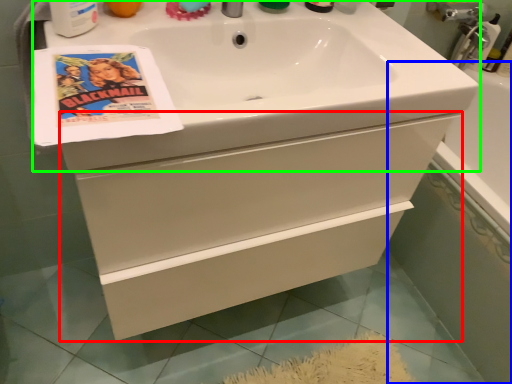
Question: Which object is positioned farthest from bathroom cabinet (highlighted by a red box)? Select from bath (highlighted by a blue box) and sink (highlighted by a green box).

Choices:
 (A) bath
 (B) sink

Answer: (A)